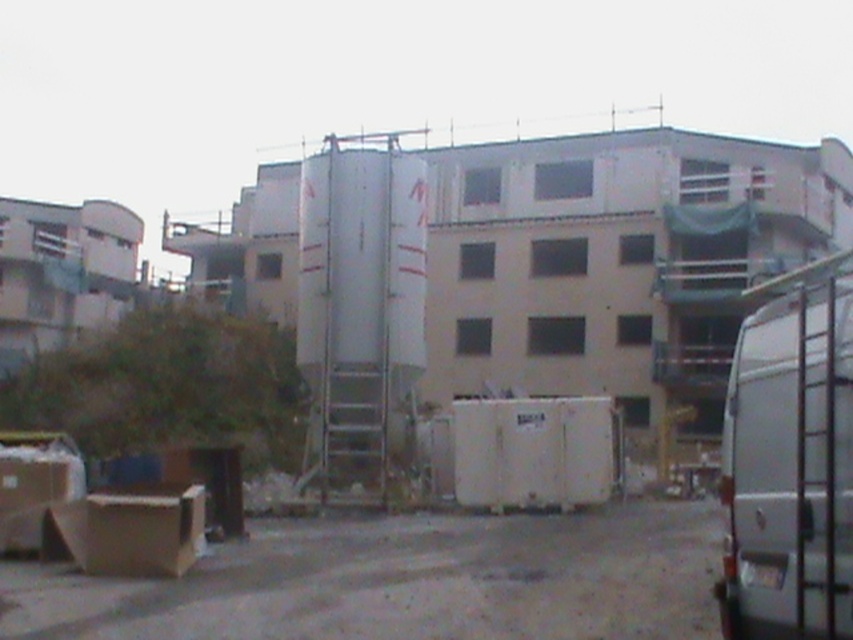
You are a delivery driver who needs to park your van next to the brown cardboard box at lower left. Can your white matte van at right fit in the space next to the box without overlapping it?

The white matte van at right is wider than the brown cardboard box at lower left. Therefore, the van may not fit next to the box without overlapping it, as its width is greater than the box.

In the scene shown: You are standing at the construction site and want to reach a specific point marked at coordinates point (436,593). If you can walk 12 meters in a straight line from your current position, will you be able to reach that point?

The distance between point (436,593) and the viewer is 10.35 meters. Since you can walk 12 meters, you will be able to reach the point as it is within your walking range.

You are standing at the construction site and want to determine the relative positions of two points marked on a blueprint. The first point is labeled as point (x=503, y=563) and the second is point (x=115, y=497). Which point is closer to you?

Point (x=503, y=563) is further to the viewer than point (x=115, y=497), so the point closer to you is point (x=115, y=497).